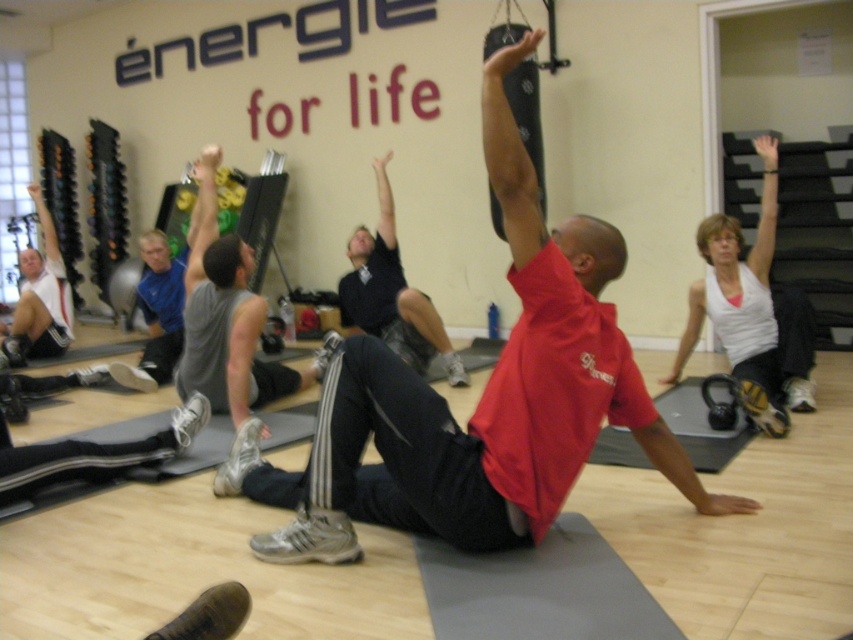
You are a photographer setting up for a group photo in the gym. You need to ensure that both the red matte shirt at center and the white matte tank top at upper right are clearly visible in the frame. Given their sizes, which participant should you position closer to the camera to maintain visibility?

The red matte shirt at center is taller than the white matte tank top at upper right, so positioning the white matte tank top at upper right closer to the camera will help maintain visibility between both participants.

You are standing at the entrance of the gym and see the point marked at coordinates (392, 292). What object or person is located at that position?

The point at coordinates (392, 292) corresponds to the dark blue shirt at center.